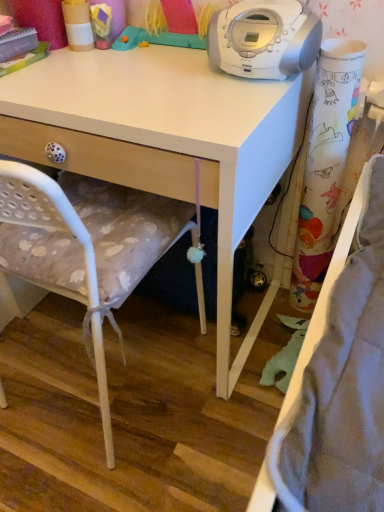
Locate an element on the screen. vacant area in front of white plastic stereo at upper center is located at coordinates (227, 108).